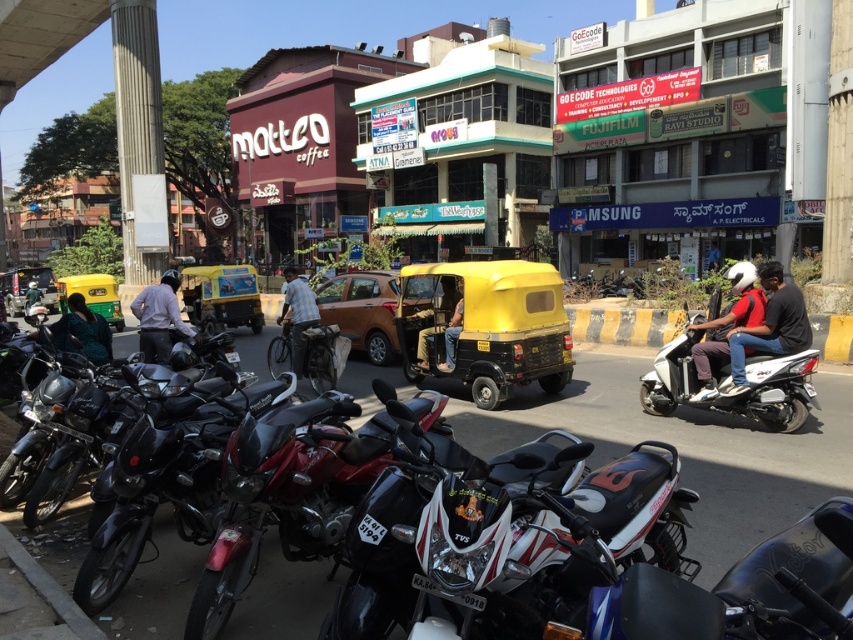
Who is positioned more to the left, white glossy motorcycle at lower right or matte yellow taxi at center?

Positioned to the left is matte yellow taxi at center.

Can you confirm if white glossy motorcycle at lower right is positioned above matte yellow taxi at center?

No, white glossy motorcycle at lower right is not above matte yellow taxi at center.

Is point (819, 621) positioned before point (364, 298)?

Yes, point (819, 621) is closer to viewer.

The width and height of the screenshot is (853, 640). I want to click on white glossy motorcycle at lower right, so click(738, 592).

How much distance is there between yellow matte taxi at center and plaid shirt at center?

yellow matte taxi at center and plaid shirt at center are 3.06 meters apart from each other.

Between point (554, 365) and point (317, 310), which one is positioned in front?

Point (554, 365) is more forward.

In order to click on yellow matte taxi at center in this screenshot , I will do `click(485, 324)`.

Measure the distance between point (404, 324) and camera.

A distance of 10.60 meters exists between point (404, 324) and camera.

Does yellow matte taxi at center have a lesser width compared to white glossy scooter at center-right?

No, yellow matte taxi at center is not thinner than white glossy scooter at center-right.

Who is more forward, (474,340) or (808,404)?

Point (808,404) is in front.

This screenshot has height=640, width=853. Find the location of `yellow matte taxi at center`. yellow matte taxi at center is located at coordinates (485, 324).